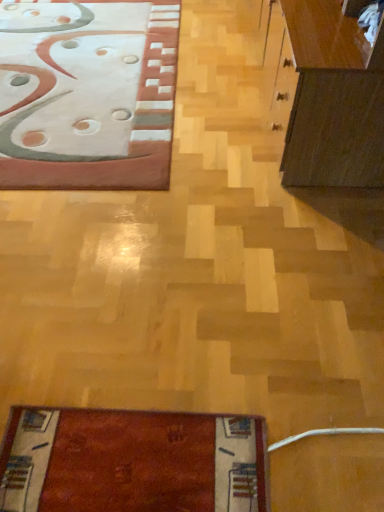
Question: Should I look upward or downward to see matte pink rug at upper left?

Choices:
 (A) up
 (B) down

Answer: (A)

Question: Does matte pink rug at upper left come in front of dark brown wood cabinet at right?

Choices:
 (A) no
 (B) yes

Answer: (A)

Question: From a real-world perspective, is matte pink rug at upper left on top of dark brown wood cabinet at right?

Choices:
 (A) yes
 (B) no

Answer: (B)

Question: Can you confirm if matte pink rug at upper left is taller than dark brown wood cabinet at right?

Choices:
 (A) no
 (B) yes

Answer: (A)

Question: Is matte pink rug at upper left surrounding dark brown wood cabinet at right?

Choices:
 (A) yes
 (B) no

Answer: (B)

Question: Is matte pink rug at upper left bigger than dark brown wood cabinet at right?

Choices:
 (A) yes
 (B) no

Answer: (B)

Question: Is matte pink rug at upper left oriented towards dark brown wood cabinet at right?

Choices:
 (A) no
 (B) yes

Answer: (A)

Question: Does dark brown wood cabinet at right have a larger size compared to matte pink rug at upper left?

Choices:
 (A) no
 (B) yes

Answer: (B)

Question: Considering the relative sizes of dark brown wood cabinet at right and matte pink rug at upper left in the image provided, is dark brown wood cabinet at right shorter than matte pink rug at upper left?

Choices:
 (A) yes
 (B) no

Answer: (B)

Question: Is matte pink rug at upper left at the back of dark brown wood cabinet at right?

Choices:
 (A) no
 (B) yes

Answer: (A)

Question: Does dark brown wood cabinet at right appear on the left side of matte pink rug at upper left?

Choices:
 (A) yes
 (B) no

Answer: (B)

Question: Is the position of dark brown wood cabinet at right more distant than that of matte pink rug at upper left?

Choices:
 (A) yes
 (B) no

Answer: (B)

Question: Is the position of dark brown wood cabinet at right less distant than that of matte pink rug at upper left?

Choices:
 (A) yes
 (B) no

Answer: (A)

Question: In terms of height, does dark brown wood cabinet at right look taller or shorter compared to matte pink rug at upper left?

Choices:
 (A) short
 (B) tall

Answer: (B)